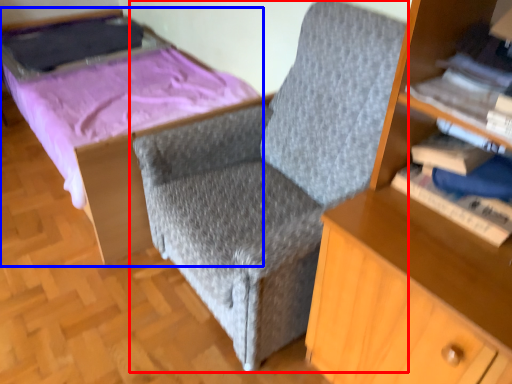
Question: Which point is closer to the camera, chair (highlighted by a red box) or bed (highlighted by a blue box)?

Choices:
 (A) chair
 (B) bed

Answer: (A)